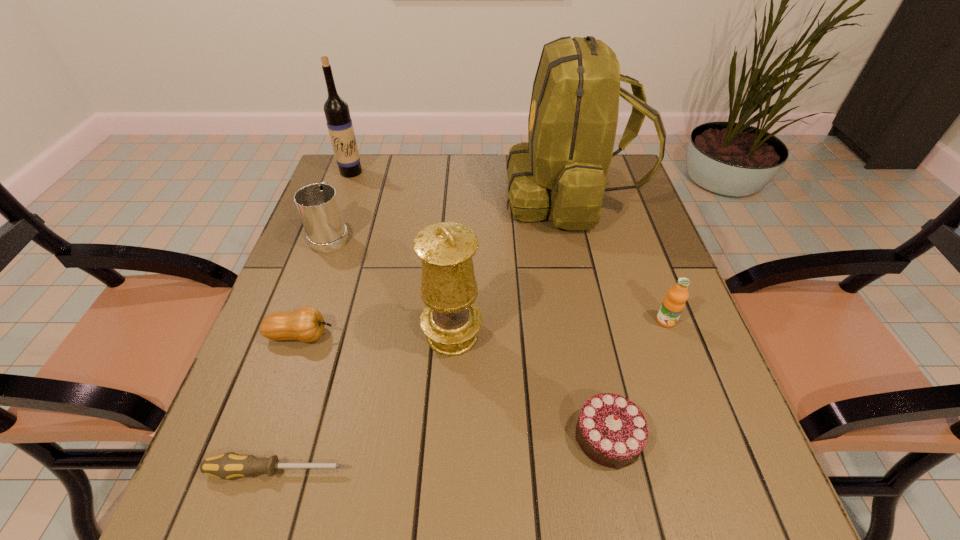
Where is `backpack`? The height and width of the screenshot is (540, 960). backpack is located at coordinates (562, 170).

Identify the location of wine bottle. This screenshot has height=540, width=960. coord(339,122).

Where is `the third tallest object`? the third tallest object is located at coordinates pyautogui.click(x=451, y=320).

The width and height of the screenshot is (960, 540). Find the location of `oil lamp`. oil lamp is located at coordinates (451, 320).

At what (x,y) coordinates should I click in order to perform the action: click on mug. Please return your answer as a coordinate pair (x, y). Looking at the image, I should click on (317, 204).

The width and height of the screenshot is (960, 540). I want to click on orange juice, so click(x=673, y=304).

Locate an element on the screen. This screenshot has height=540, width=960. gourd is located at coordinates (306, 324).

The width and height of the screenshot is (960, 540). Find the location of `chocolate cake`. chocolate cake is located at coordinates (611, 430).

Identify the location of the shortest object. The image size is (960, 540). (225, 466).

Identify the location of vacant space located 0.370m on the front-facing side of the backpack. The image size is (960, 540). (378, 195).